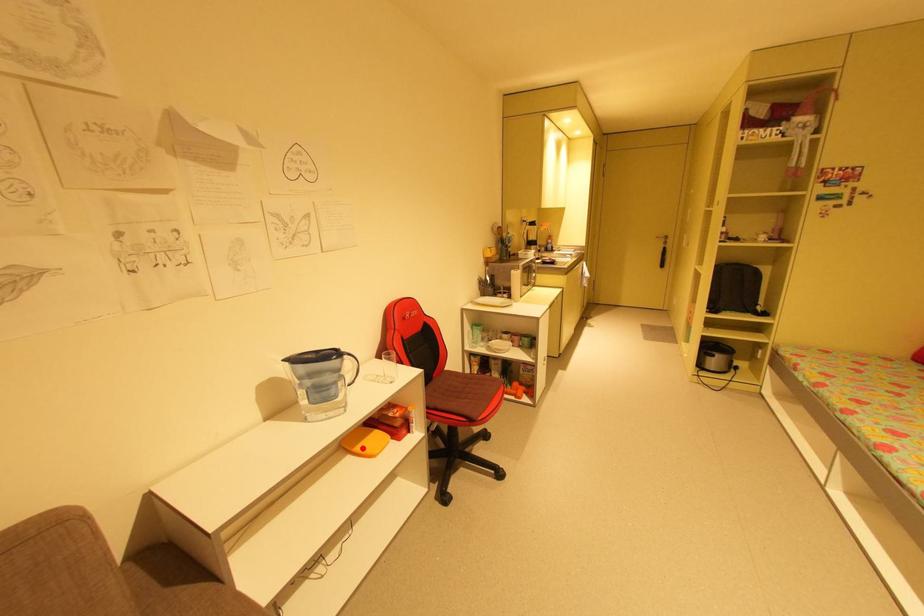
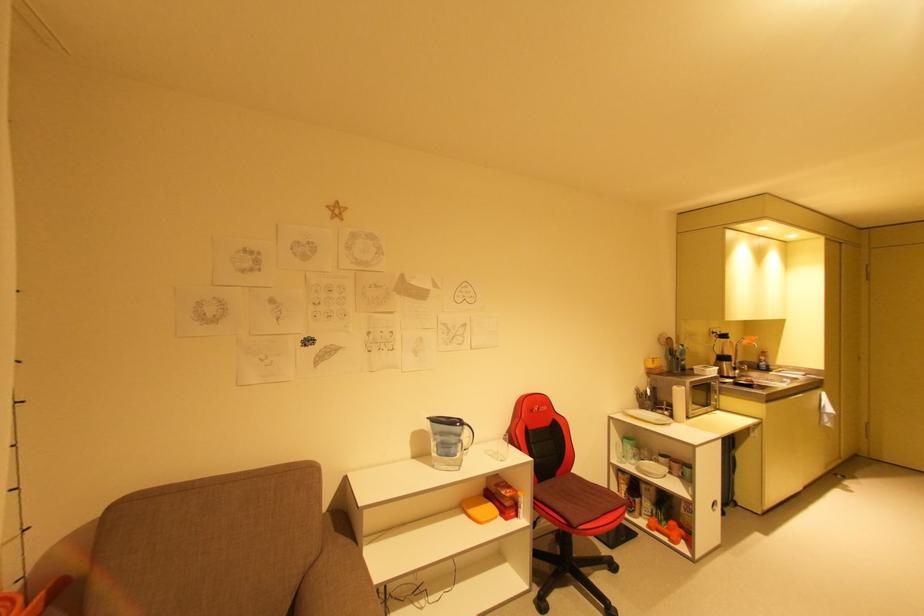
Question: I am providing you with two images of the same scene from different viewpoints. Image1 has a red point marked. In image2, the corresponding 3D location appears at what relative position? Reply with the corresponding letter.

Choices:
 (A) Closer
 (B) Farther

Answer: (B)